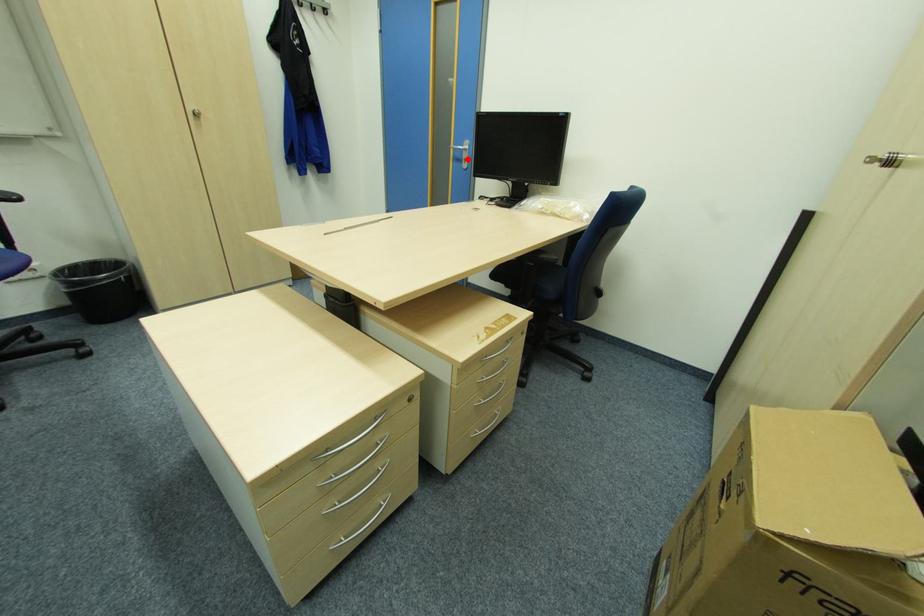
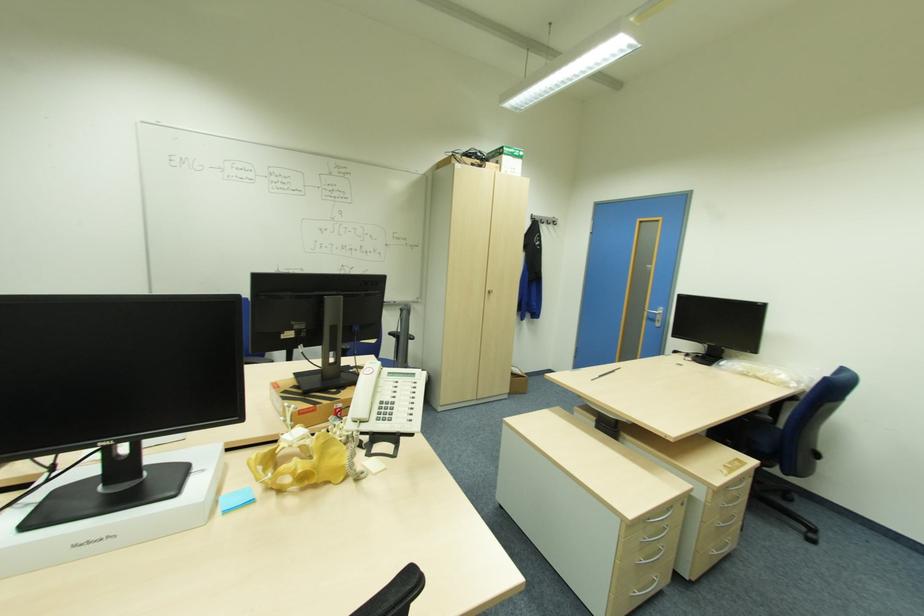
Question: A red point is marked in image1. In image2, is the corresponding 3D point closer to the camera or farther? Reply with the corresponding letter.

Choices:
 (A) The corresponding 3D point is closer.
 (B) The corresponding 3D point is farther.

Answer: (B)